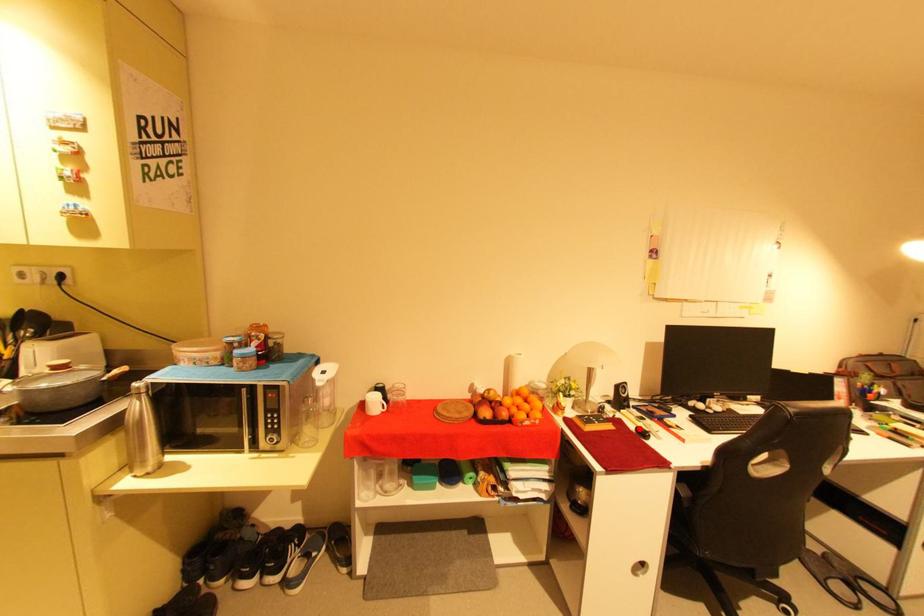
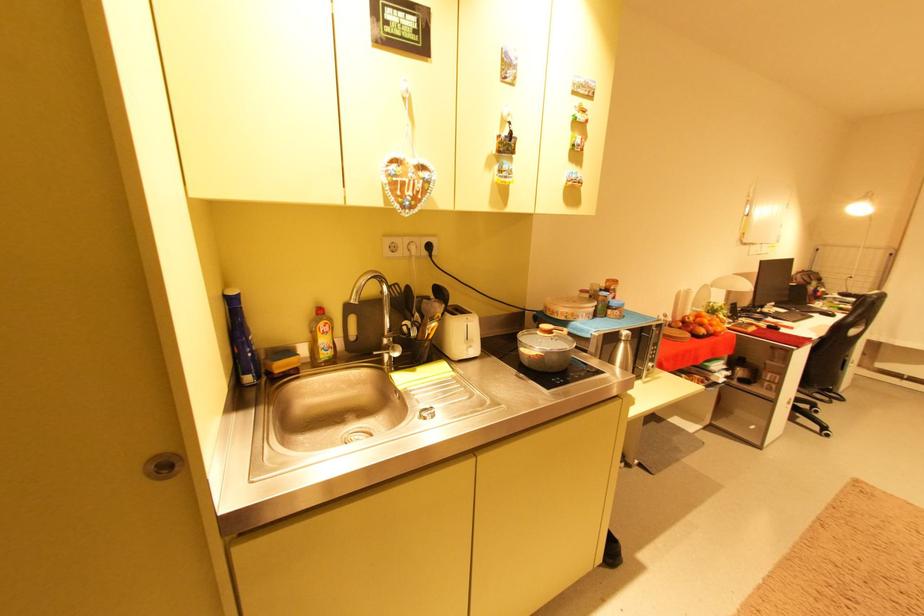
Question: I am providing you with two images of the same scene from different viewpoints. A red point is marked on the first image. Is the red point's position out of view in image 2?

Choices:
 (A) Yes
 (B) No

Answer: (A)